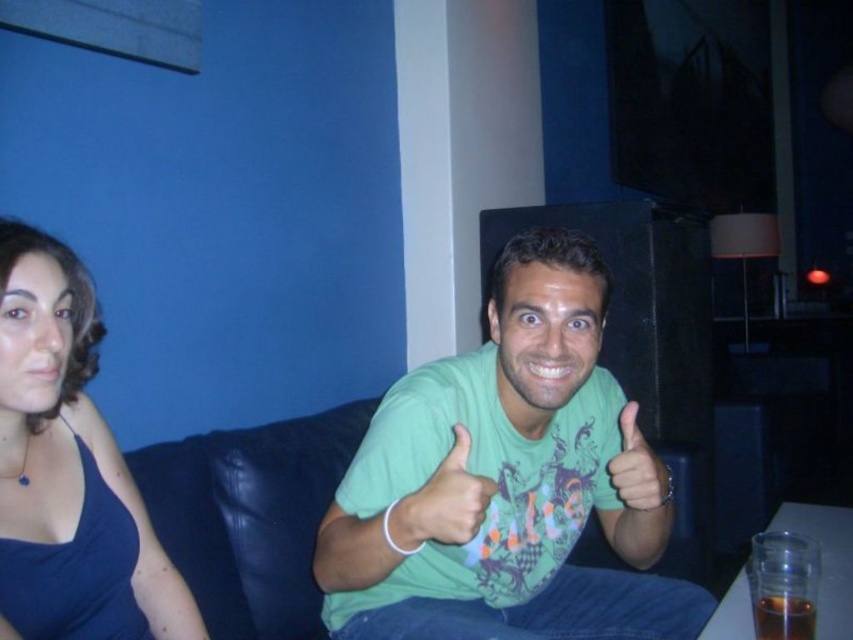
Question: Considering the relative positions of matte green hand at center and translucent glass at lower right in the image provided, where is matte green hand at center located with respect to translucent glass at lower right?

Choices:
 (A) below
 (B) above

Answer: (B)

Question: From the image, what is the correct spatial relationship of satin blue dress at left in relation to green matte hand at center?

Choices:
 (A) right
 (B) left

Answer: (B)

Question: Which object is the farthest from the satin blue dress at left?

Choices:
 (A) green matte shirt at center
 (B) translucent glass at lower right
 (C) green matte hand at center
 (D) matte green hand at center

Answer: (B)

Question: Which point is closer to the camera?

Choices:
 (A) (572, 291)
 (B) (784, 602)
 (C) (80, 513)

Answer: (B)

Question: Can you confirm if green matte shirt at center is positioned to the right of green matte hand at center?

Choices:
 (A) yes
 (B) no

Answer: (A)

Question: Which point is farther to the camera?

Choices:
 (A) matte green hand at center
 (B) green matte hand at center
 (C) satin blue dress at left
 (D) green matte shirt at center

Answer: (A)